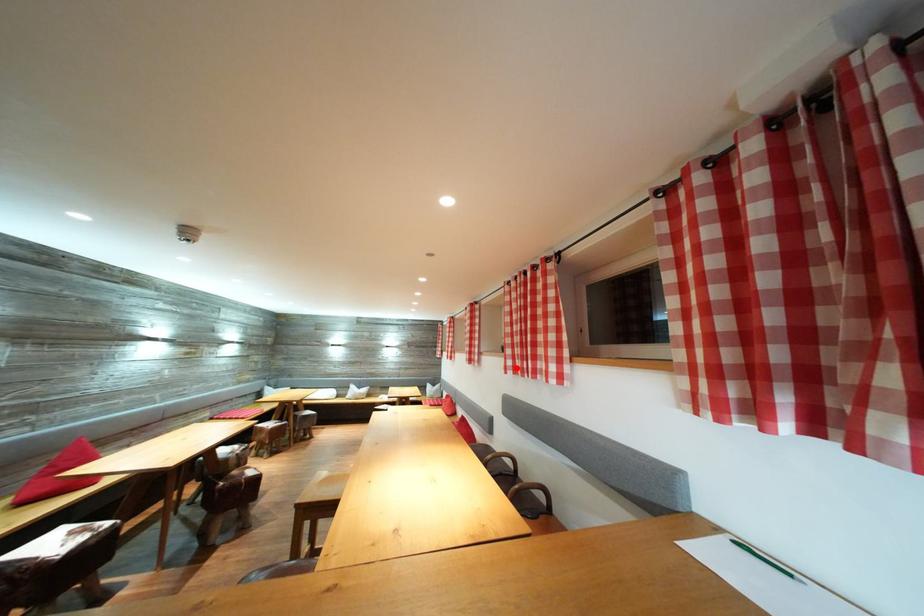
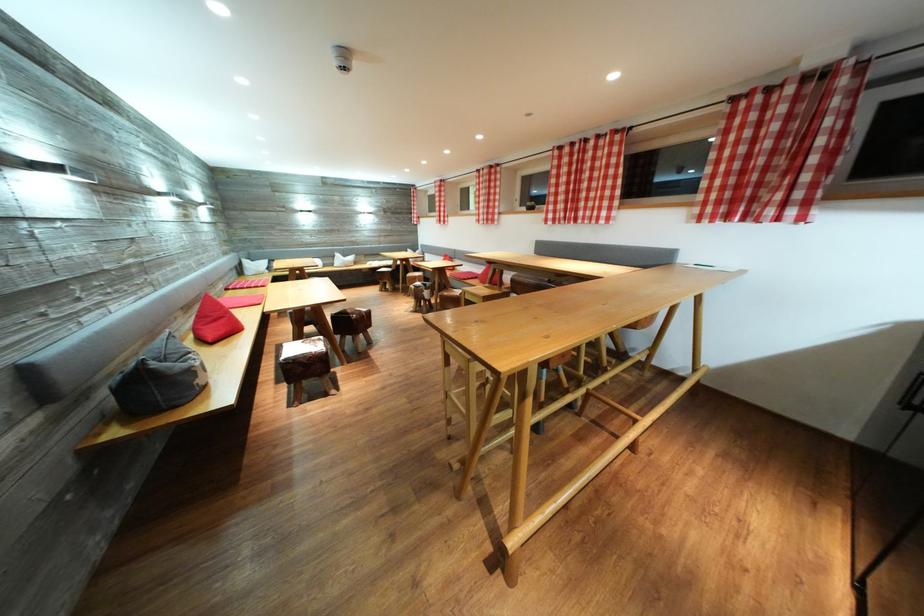
Where in the second image is the point corresponding to the highlighted location from the first image?

(556, 222)